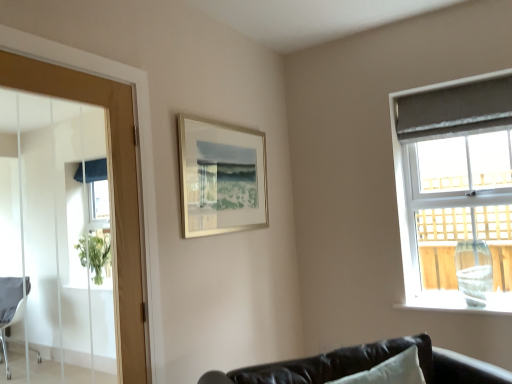
Find the location of a particular element. free spot above wooden door at left (from a real-world perspective) is located at coordinates [68, 67].